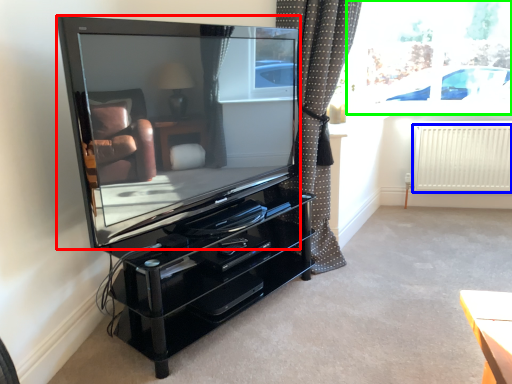
Question: Based on their relative distances, which object is nearer to television (highlighted by a red box)? Choose from radiator (highlighted by a blue box) and window screen (highlighted by a green box).

Choices:
 (A) radiator
 (B) window screen

Answer: (B)